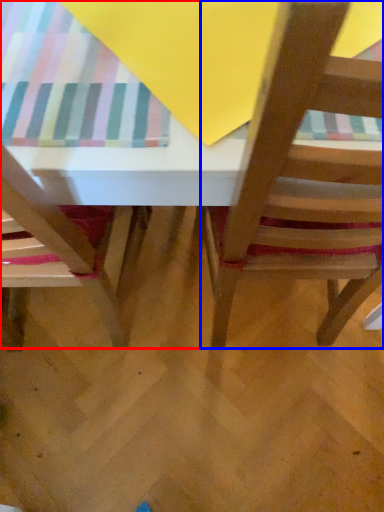
Question: Which of the following is the farthest to the observer, table (highlighted by a red box) or chair (highlighted by a blue box)?

Choices:
 (A) table
 (B) chair

Answer: (A)